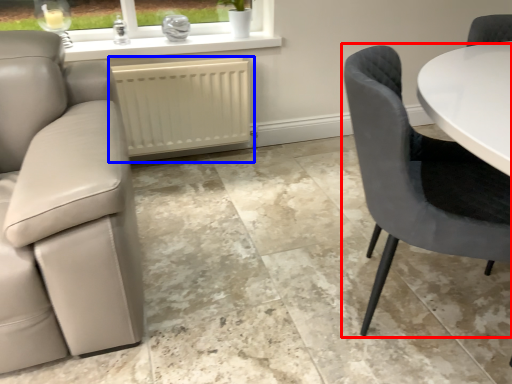
Question: Which object appears closest to the camera in this image, chair (highlighted by a red box) or radiator (highlighted by a blue box)?

Choices:
 (A) chair
 (B) radiator

Answer: (A)